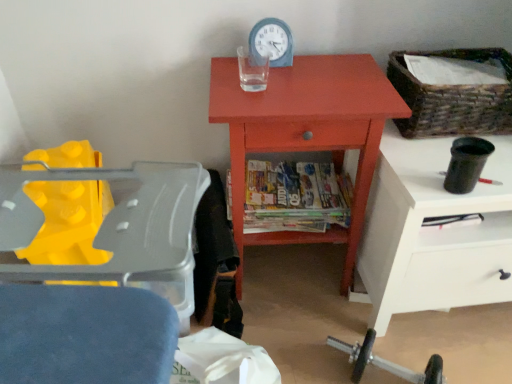
Question: Is the depth of multicolored glossy magazines at center greater than that of blue plastic clock at upper center?

Choices:
 (A) yes
 (B) no

Answer: (A)

Question: Can we say multicolored glossy magazines at center lies outside blue plastic clock at upper center?

Choices:
 (A) yes
 (B) no

Answer: (A)

Question: From a real-world perspective, is multicolored glossy magazines at center beneath blue plastic clock at upper center?

Choices:
 (A) yes
 (B) no

Answer: (A)

Question: Considering the relative sizes of multicolored glossy magazines at center and blue plastic clock at upper center in the image provided, is multicolored glossy magazines at center wider than blue plastic clock at upper center?

Choices:
 (A) yes
 (B) no

Answer: (A)

Question: Is multicolored glossy magazines at center aimed at blue plastic clock at upper center?

Choices:
 (A) yes
 (B) no

Answer: (B)

Question: From a real-world perspective, is matte orange cabinet at center above or below blue plastic clock at upper center?

Choices:
 (A) above
 (B) below

Answer: (B)

Question: From the image's perspective, relative to blue plastic clock at upper center, is matte orange cabinet at center above or below?

Choices:
 (A) above
 (B) below

Answer: (B)

Question: Is matte orange cabinet at center to the left or to the right of blue plastic clock at upper center in the image?

Choices:
 (A) left
 (B) right

Answer: (B)

Question: Considering the positions of matte orange cabinet at center and blue plastic clock at upper center in the image, is matte orange cabinet at center bigger or smaller than blue plastic clock at upper center?

Choices:
 (A) big
 (B) small

Answer: (A)

Question: Is multicolored glossy magazines at center in front of or behind matte orange cabinet at center in the image?

Choices:
 (A) front
 (B) behind

Answer: (B)

Question: From the image's perspective, is multicolored glossy magazines at center above or below matte orange cabinet at center?

Choices:
 (A) below
 (B) above

Answer: (A)

Question: Based on their sizes in the image, would you say multicolored glossy magazines at center is bigger or smaller than matte orange cabinet at center?

Choices:
 (A) small
 (B) big

Answer: (A)

Question: Is multicolored glossy magazines at center inside or outside of matte orange cabinet at center?

Choices:
 (A) inside
 (B) outside

Answer: (A)

Question: Does point (490, 92) appear closer or farther from the camera than point (249, 46)?

Choices:
 (A) closer
 (B) farther

Answer: (A)

Question: Visually, is woven brown basket at upper right positioned to the left or to the right of blue plastic clock at upper center?

Choices:
 (A) right
 (B) left

Answer: (A)